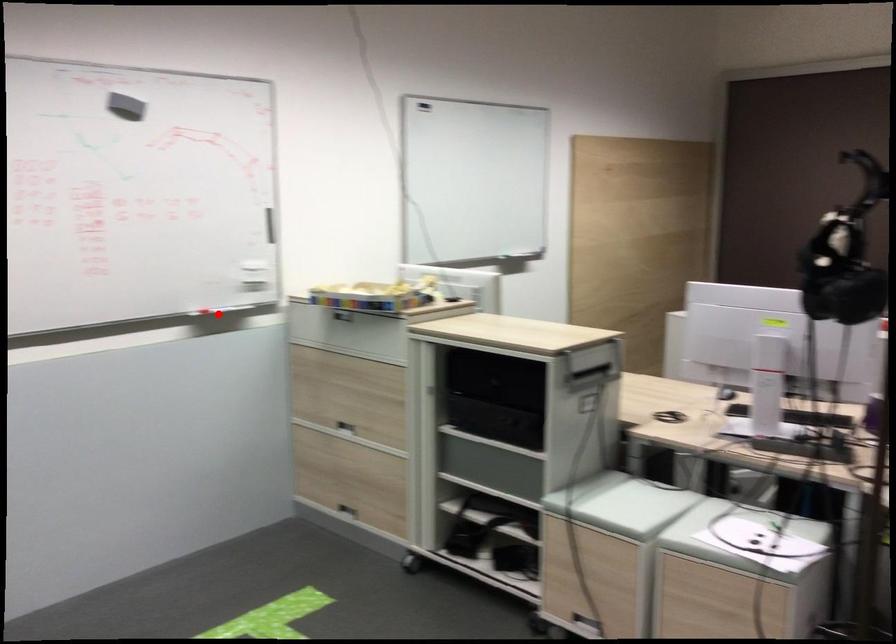
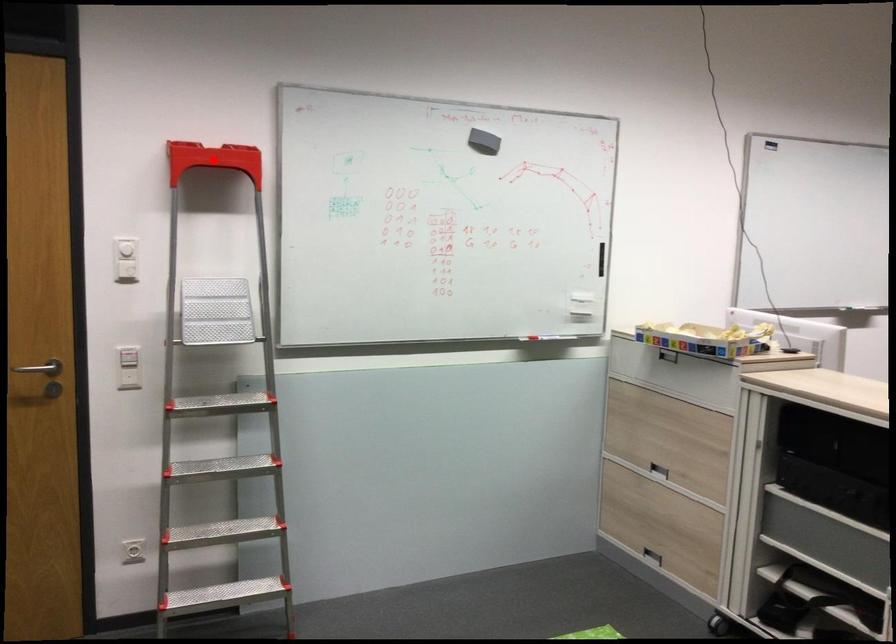
I am providing you with two images of the same scene from different viewpoints. A red point is marked on the first image and another point is marked on the second image. Is the marked point in image1 the same physical position as the marked point in image2?

No